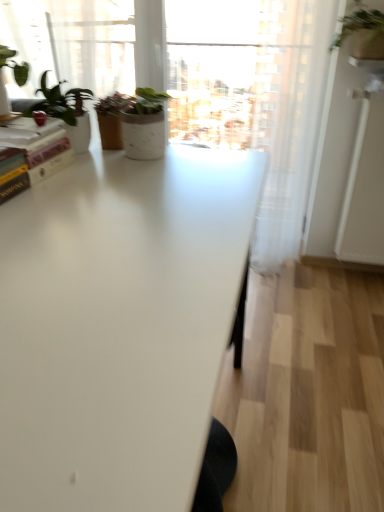
Question: Is hardcover book at upper left oriented away from white glossy table at center?

Choices:
 (A) yes
 (B) no

Answer: (A)

Question: From the image's perspective, is hardcover book at upper left above white glossy table at center?

Choices:
 (A) yes
 (B) no

Answer: (A)

Question: Is hardcover book at upper left wider than white glossy table at center?

Choices:
 (A) yes
 (B) no

Answer: (B)

Question: Can you confirm if hardcover book at upper left is bigger than white glossy table at center?

Choices:
 (A) no
 (B) yes

Answer: (A)

Question: Is the depth of hardcover book at upper left less than that of white glossy table at center?

Choices:
 (A) no
 (B) yes

Answer: (A)

Question: Considering the positions of point (369, 231) and point (365, 25), is point (369, 231) closer or farther from the camera than point (365, 25)?

Choices:
 (A) farther
 (B) closer

Answer: (A)

Question: Considering their positions, is white glossy screen door at right located in front of or behind green matte plant at upper right?

Choices:
 (A) behind
 (B) front

Answer: (A)

Question: From the image's perspective, is white glossy screen door at right located above or below green matte plant at upper right?

Choices:
 (A) below
 (B) above

Answer: (A)

Question: Looking at the image, does white glossy screen door at right seem bigger or smaller compared to green matte plant at upper right?

Choices:
 (A) big
 (B) small

Answer: (A)

Question: From a real-world perspective, is green matte plant at upper right positioned above or below white glossy screen door at right?

Choices:
 (A) above
 (B) below

Answer: (A)

Question: From the image's perspective, is green matte plant at upper right above or below white glossy screen door at right?

Choices:
 (A) above
 (B) below

Answer: (A)

Question: Considering the positions of green matte plant at upper right and white glossy screen door at right in the image, is green matte plant at upper right bigger or smaller than white glossy screen door at right?

Choices:
 (A) small
 (B) big

Answer: (A)

Question: In terms of width, does green matte plant at upper right look wider or thinner when compared to white glossy screen door at right?

Choices:
 (A) wide
 (B) thin

Answer: (A)

Question: Based on their positions, is green matte plant pot at upper left located to the left or right of white glossy screen door at right?

Choices:
 (A) right
 (B) left

Answer: (B)

Question: Is green matte plant pot at upper left taller or shorter than white glossy screen door at right?

Choices:
 (A) short
 (B) tall

Answer: (A)